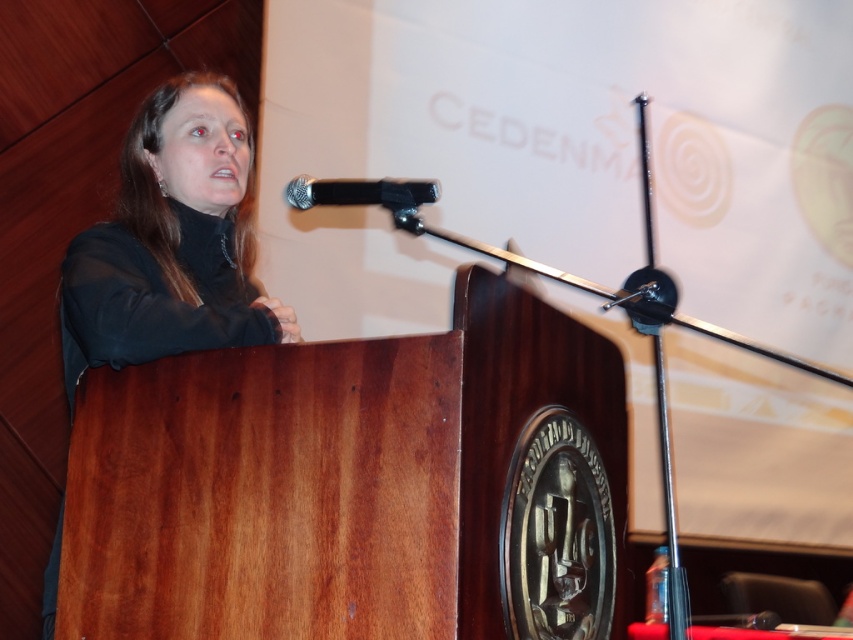
You are an event planner setting up for a presentation. You need to place a small microphone stand exactly at the point with coordinates point [172,241]. Based on the scene, where should you place the microphone stand?

The point [172,241] is located on the black matte tacky sweater at upper left, so you should place the microphone stand there.